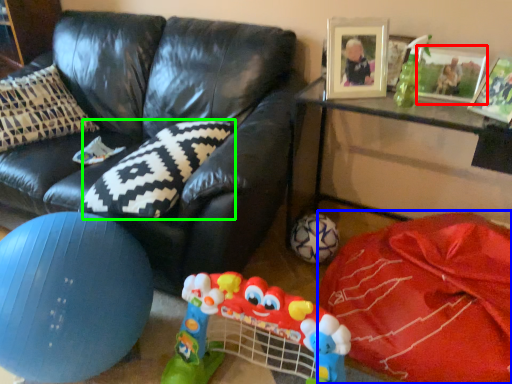
Question: Which is nearer to the picture frame (highlighted by a red box)? material (highlighted by a blue box) or pillow (highlighted by a green box).

Choices:
 (A) material
 (B) pillow

Answer: (A)